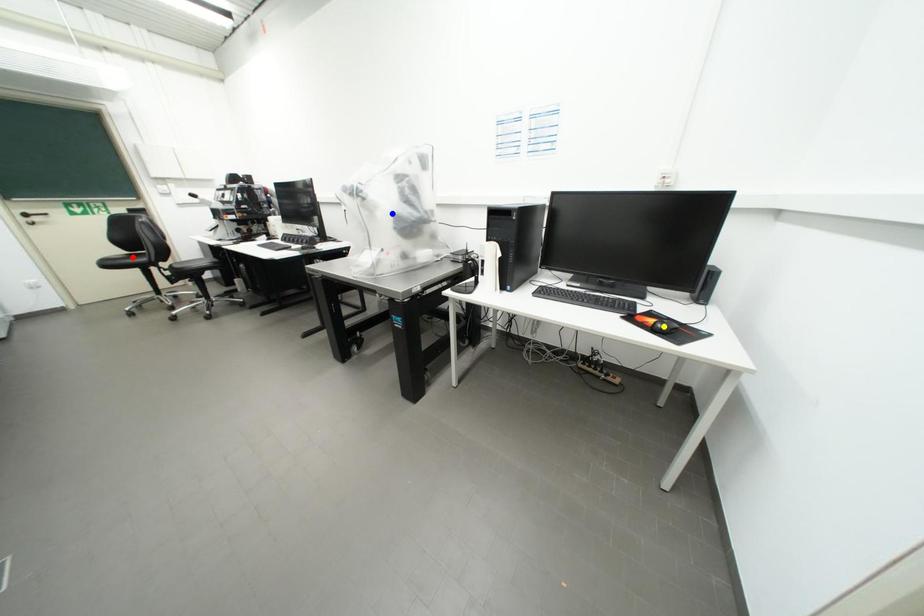
Order these from nearest to farthest:
A) red point
B) blue point
C) yellow point

1. red point
2. blue point
3. yellow point